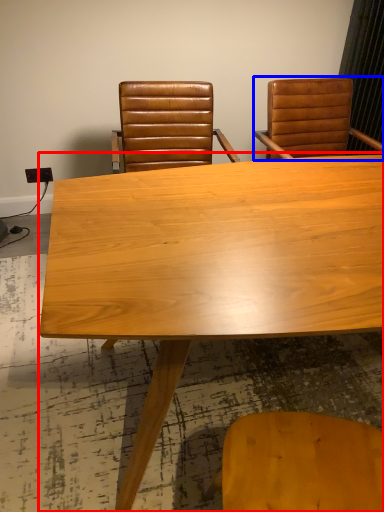
Question: Among these objects, which one is nearest to the camera, table (highlighted by a red box) or chair (highlighted by a blue box)?

Choices:
 (A) table
 (B) chair

Answer: (A)